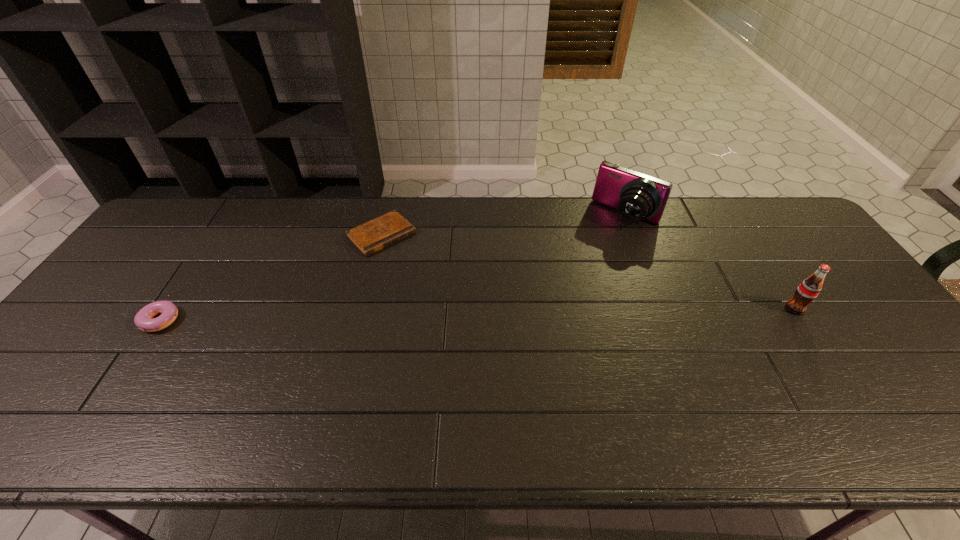
At what (x,y) coordinates should I click in order to perform the action: click on the leftmost object. Please return your answer as a coordinate pair (x, y). The width and height of the screenshot is (960, 540). Looking at the image, I should click on (143, 320).

Identify the location of the third tallest object. The height and width of the screenshot is (540, 960). (143, 320).

Locate an element on the screen. soda is located at coordinates (809, 289).

Where is `diary`? diary is located at coordinates (370, 237).

The width and height of the screenshot is (960, 540). I want to click on the second object from left to right, so click(x=370, y=237).

Where is `the second object from right to left`? the second object from right to left is located at coordinates (637, 196).

Locate an element on the screen. This screenshot has height=540, width=960. free region located on the back of the leftmost object is located at coordinates tap(227, 219).

At what (x,y) coordinates should I click in order to perform the action: click on vacant area situated on the back of the soda. Please return your answer as a coordinate pair (x, y). Image resolution: width=960 pixels, height=540 pixels. Looking at the image, I should click on (744, 233).

Where is `vacant space located 0.150m on the spine side of the diary`? The width and height of the screenshot is (960, 540). vacant space located 0.150m on the spine side of the diary is located at coordinates (428, 279).

Locate an element on the screen. Image resolution: width=960 pixels, height=540 pixels. free space located 0.290m on the spine side of the diary is located at coordinates pyautogui.click(x=458, y=307).